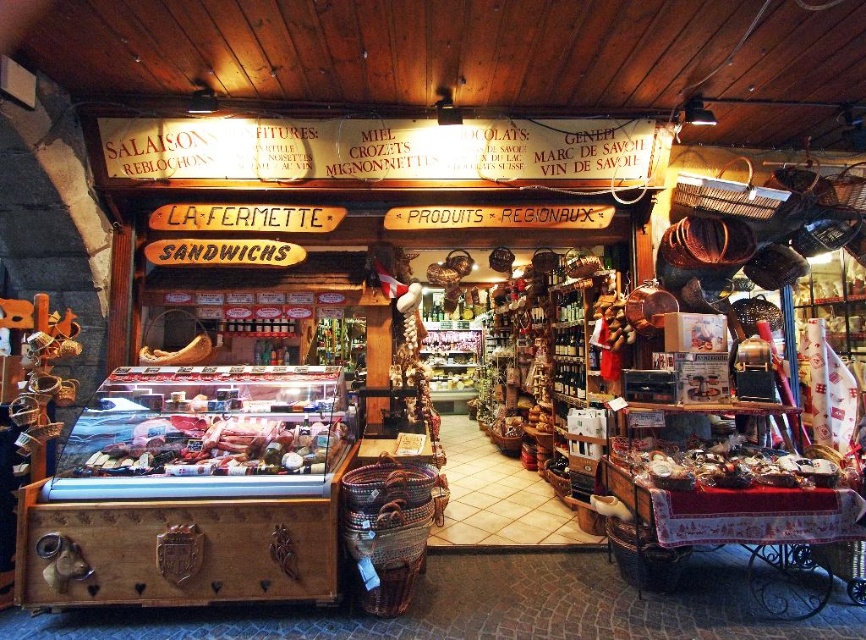
Question: Which point is farther from the camera taking this photo?

Choices:
 (A) (712, 468)
 (B) (66, 474)
 (C) (176, 364)

Answer: (C)

Question: Where is shiny pink meat at center located in relation to shiny metallic trinkets at lower right in the image?

Choices:
 (A) below
 (B) above

Answer: (B)

Question: Does shiny pink meat at center have a smaller size compared to matte brown cheese at center left?

Choices:
 (A) yes
 (B) no

Answer: (B)

Question: Which object appears closest to the camera in this image?

Choices:
 (A) shiny pink meat at center
 (B) matte brown cheese at center left
 (C) shiny metallic trinkets at lower right

Answer: (C)

Question: Is shiny pink meat at center smaller than shiny metallic trinkets at lower right?

Choices:
 (A) no
 (B) yes

Answer: (A)

Question: Which point appears farthest from the camera in this image?

Choices:
 (A) (165, 358)
 (B) (118, 461)

Answer: (A)